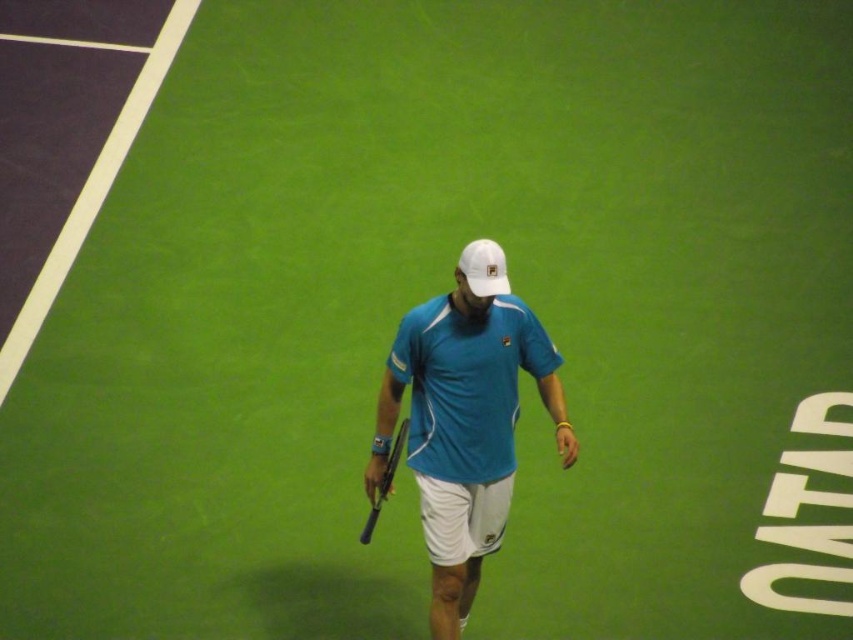
Question: Among these objects, which one is nearest to the camera?

Choices:
 (A) black matte tennis racket at center
 (B) black rubber tennis racket at center
 (C) blue fabric shirt at center

Answer: (C)

Question: Which of these objects is positioned closest to the black rubber tennis racket at center?

Choices:
 (A) blue fabric shirt at center
 (B) black matte tennis racket at center

Answer: (B)

Question: Does blue fabric shirt at center have a greater width compared to black matte tennis racket at center?

Choices:
 (A) no
 (B) yes

Answer: (B)

Question: Among these points, which one is farthest from the camera?

Choices:
 (A) (364, 474)
 (B) (376, 486)

Answer: (A)

Question: Does black matte tennis racket at center have a lesser width compared to black rubber tennis racket at center?

Choices:
 (A) no
 (B) yes

Answer: (A)

Question: Is blue fabric shirt at center smaller than black matte tennis racket at center?

Choices:
 (A) no
 (B) yes

Answer: (A)